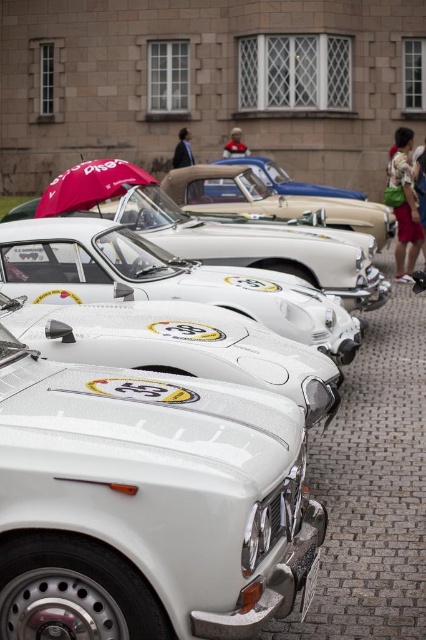
You are a photographer standing on the cobblestone street wanting to take a photo of the metallic blue car at center and the camouflage fabric backpack at right. Which object should you focus on first if you want to capture both in a single shot without moving your camera?

You should focus on the metallic blue car at center first because the camouflage fabric backpack at right is closer to the viewer, so adjusting focus from near to far would allow both to be in focus if using a shallow depth of field or by focusing on the midpoint between them.

Looking at this image, you are a photographer standing on the cobblestone street and want to take a picture of the white glossy car at center and the camouflage fabric backpack at right. Since you want to include both in the frame, which object should you focus on first to ensure both are in focus?

The white glossy car at center is located above the camouflage fabric backpack at right, so you should focus on the white glossy car at center first to ensure both are in focus.